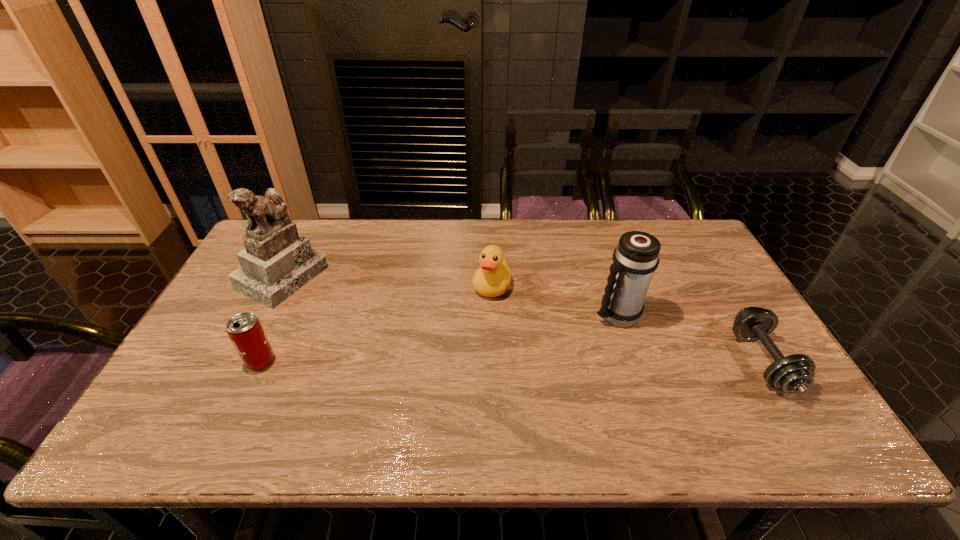
Where is `free space located 0.120m on the side with the handle of the thermos bottle`? Image resolution: width=960 pixels, height=540 pixels. free space located 0.120m on the side with the handle of the thermos bottle is located at coordinates (574, 347).

Where is `vacant space located 0.120m on the side with the handle of the thermos bottle`? The height and width of the screenshot is (540, 960). vacant space located 0.120m on the side with the handle of the thermos bottle is located at coordinates (574, 347).

Where is `free space located on the front-facing side of the figurine`? free space located on the front-facing side of the figurine is located at coordinates (417, 343).

Image resolution: width=960 pixels, height=540 pixels. In order to click on vacant region located 0.130m on the front-facing side of the figurine in this screenshot , I will do `click(344, 308)`.

Locate an element on the screen. vacant area situated on the front-facing side of the figurine is located at coordinates (408, 339).

Where is `free space located at the beak of the duck`? The height and width of the screenshot is (540, 960). free space located at the beak of the duck is located at coordinates (469, 338).

In order to click on free space located at the beak of the duck in this screenshot , I will do `click(454, 373)`.

Identify the location of vacant space situated at the beak of the duck. (451, 379).

The height and width of the screenshot is (540, 960). What are the coordinates of `object present at the far edge` in the screenshot? It's located at (277, 262).

The image size is (960, 540). In order to click on object that is at the near edge in this screenshot , I will do `click(795, 373)`.